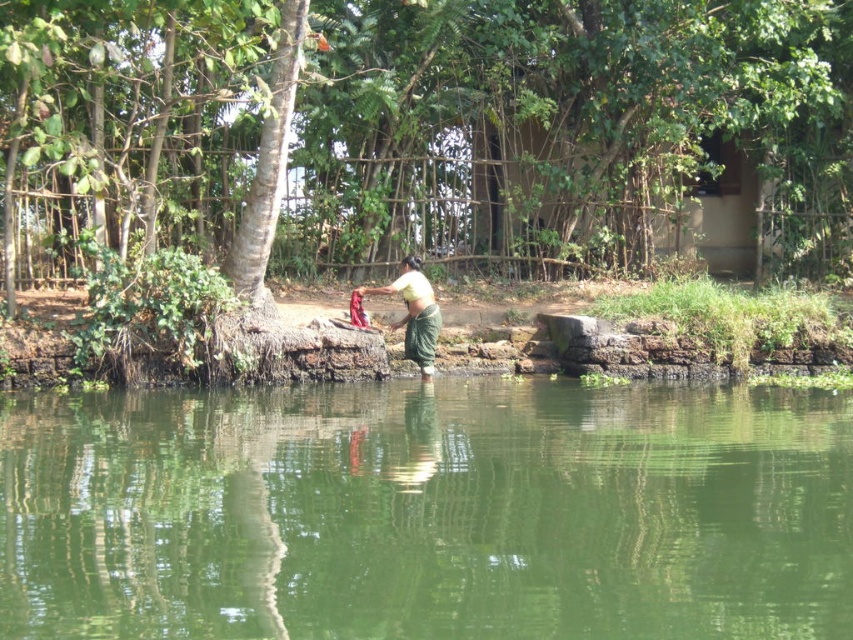
Measure the distance between green smooth water at center and yellow-green fabric at center.

green smooth water at center and yellow-green fabric at center are 3.40 meters apart.

Who is lower down, green smooth water at center or yellow-green fabric at center?

green smooth water at center is lower down.

Image resolution: width=853 pixels, height=640 pixels. Find the location of `green smooth water at center`. green smooth water at center is located at coordinates (427, 512).

Identify the location of green smooth water at center. The image size is (853, 640). (427, 512).

Which is behind, point (724, 4) or point (421, 291)?

The point (724, 4) is behind.

Which is more to the left, green leafy tree at center or yellow-green fabric at center?

From the viewer's perspective, yellow-green fabric at center appears more on the left side.

Is point (587, 129) farther from viewer compared to point (434, 336)?

Yes, it is.

At what (x,y) coordinates should I click in order to perform the action: click on green leafy tree at center. Please return your answer as a coordinate pair (x, y). This screenshot has height=640, width=853. Looking at the image, I should click on (407, 115).

Between green smooth water at center and green leafy tree at center, which one is positioned higher?

green leafy tree at center

Between point (666, 429) and point (808, 17), which one is positioned behind?

Positioned behind is point (808, 17).

The width and height of the screenshot is (853, 640). Describe the element at coordinates (427, 512) in the screenshot. I see `green smooth water at center` at that location.

At what (x,y) coordinates should I click in order to perform the action: click on green smooth water at center. Please return your answer as a coordinate pair (x, y). Looking at the image, I should click on (427, 512).